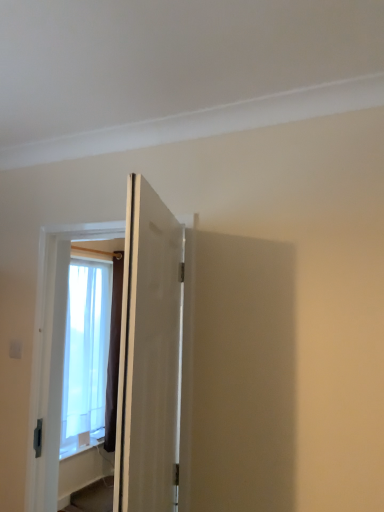
Question: From a real-world perspective, is white matte door at center, marked as the 1th door in a back-to-front arrangement, over translucent fabric window at left?

Choices:
 (A) no
 (B) yes

Answer: (B)

Question: Is white matte door at center, marked as the 1th door in a back-to-front arrangement, to the right of translucent fabric window at left from the viewer's perspective?

Choices:
 (A) no
 (B) yes

Answer: (B)

Question: Is white matte door at center, marked as the 1th door in a back-to-front arrangement, not close to translucent fabric window at left?

Choices:
 (A) yes
 (B) no

Answer: (A)

Question: Is white matte door at center, placed as the 2th door when sorted from front to back, to the left of translucent fabric window at left from the viewer's perspective?

Choices:
 (A) yes
 (B) no

Answer: (B)

Question: Can you confirm if white matte door at center, marked as the 1th door in a back-to-front arrangement, is shorter than translucent fabric window at left?

Choices:
 (A) yes
 (B) no

Answer: (A)

Question: Can translucent fabric window at left be found inside white matte door at center, placed as the 2th door when sorted from front to back?

Choices:
 (A) no
 (B) yes

Answer: (A)

Question: Is translucent fabric window at left not within white matte door at center, marked as the 1th door in a back-to-front arrangement?

Choices:
 (A) no
 (B) yes

Answer: (B)

Question: Does translucent fabric window at left lie in front of white matte door at center, marked as the 1th door in a back-to-front arrangement?

Choices:
 (A) no
 (B) yes

Answer: (A)

Question: Does translucent fabric window at left have a greater height compared to white matte door at center, marked as the 1th door in a back-to-front arrangement?

Choices:
 (A) no
 (B) yes

Answer: (B)

Question: Can you confirm if translucent fabric window at left is positioned to the left of white matte door at center, placed as the 2th door when sorted from front to back?

Choices:
 (A) yes
 (B) no

Answer: (A)

Question: Is white matte door at center, marked as the 1th door in a back-to-front arrangement, at the back of translucent fabric window at left?

Choices:
 (A) no
 (B) yes

Answer: (A)

Question: From the image's perspective, is translucent fabric window at left below white matte door at center, marked as the 1th door in a back-to-front arrangement?

Choices:
 (A) yes
 (B) no

Answer: (A)

Question: Can you confirm if translucent fabric window at left is smaller than matte white door at center, which appears as the first door when viewed from the front?

Choices:
 (A) no
 (B) yes

Answer: (A)